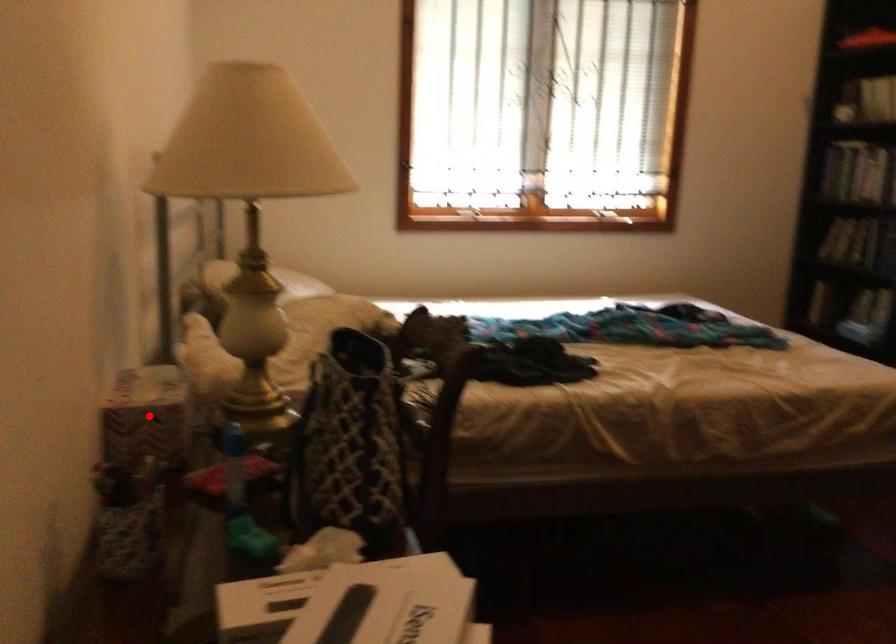
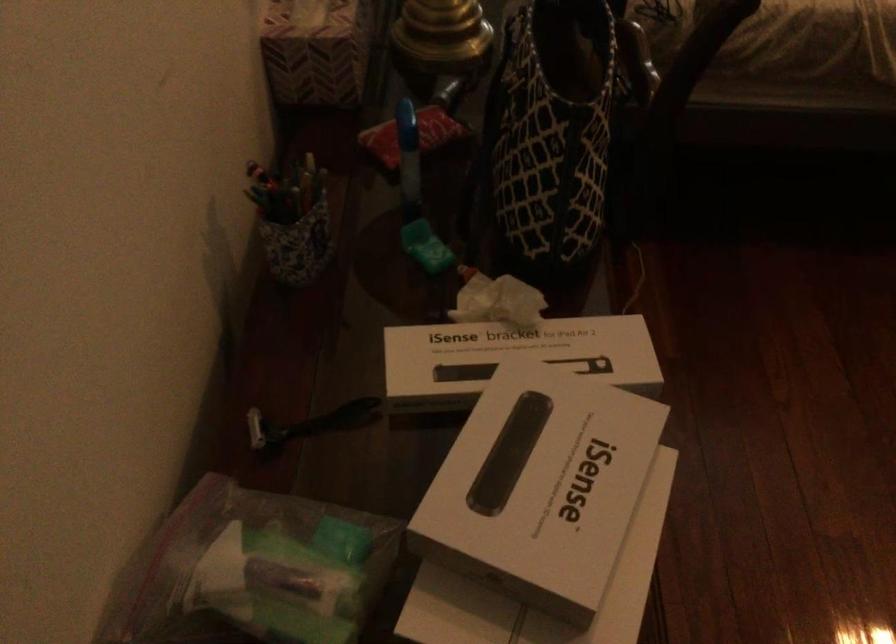
Question: I am providing you with two images of the same scene from different viewpoints. Image1 has a red point marked. In image2, the corresponding 3D location appears at what relative position? Reply with the corresponding letter.

Choices:
 (A) Closer
 (B) Farther

Answer: (A)